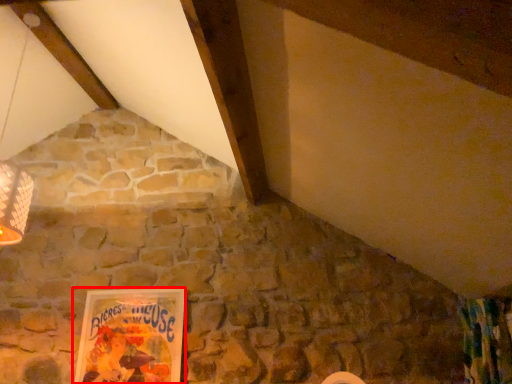
Question: From the image's perspective, considering the relative positions of picture frame (annotated by the red box) and curtain in the image provided, where is picture frame (annotated by the red box) located with respect to the staircase?

Choices:
 (A) above
 (B) below

Answer: (B)